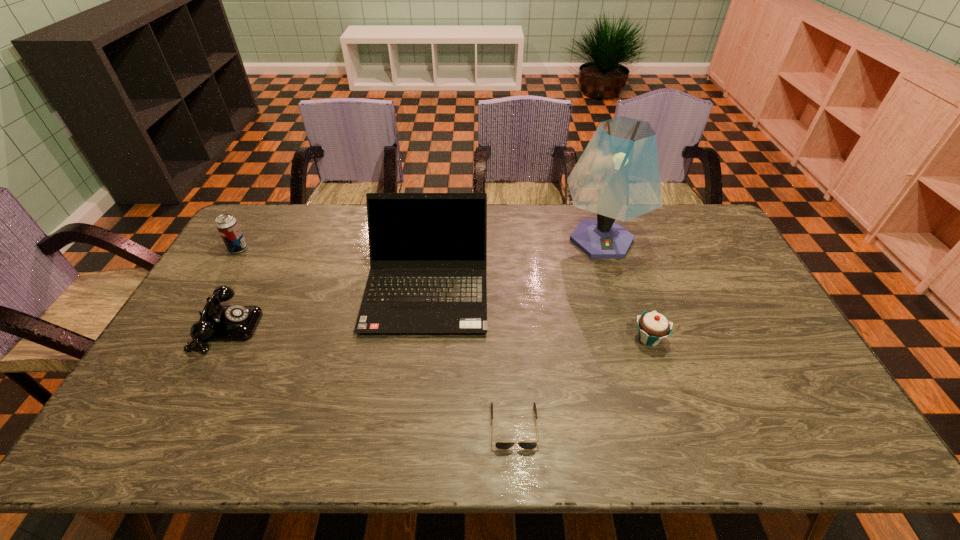
This screenshot has height=540, width=960. In the image, there is a desktop. What are the coordinates of `free region at the near edge` in the screenshot? It's located at (487, 422).

What are the coordinates of `vacant space at the left edge of the desktop` in the screenshot? It's located at (238, 267).

The image size is (960, 540). What are the coordinates of `vacant space at the right edge of the desktop` in the screenshot? It's located at [x=735, y=259].

Find the location of a particular element. This screenshot has width=960, height=540. vacant area that lies between the sunglasses and the third object from left to right is located at coordinates (470, 356).

The height and width of the screenshot is (540, 960). What are the coordinates of `free space between the nearest object and the telephone` in the screenshot? It's located at (372, 376).

You are a GUI agent. You are given a task and a screenshot of the screen. Output one action in this format:
    pyautogui.click(x=<x>, y=<y>)
    Task: Click on the free space between the telephone and the fourth object from left to right
    
    Given the screenshot: What is the action you would take?
    pyautogui.click(x=372, y=376)

Find the location of a particular element. The height and width of the screenshot is (540, 960). vacant area that lies between the second tallest object and the fourth shortest object is located at coordinates (333, 268).

Image resolution: width=960 pixels, height=540 pixels. In order to click on vacant area that lies between the telephone and the laptop computer in this screenshot , I will do `click(327, 308)`.

Locate an element on the screen. vacant area that lies between the fourth shortest object and the telephone is located at coordinates (233, 288).

Where is `vacant area between the shortest object and the fifth shortest object`? The image size is (960, 540). vacant area between the shortest object and the fifth shortest object is located at coordinates (470, 356).